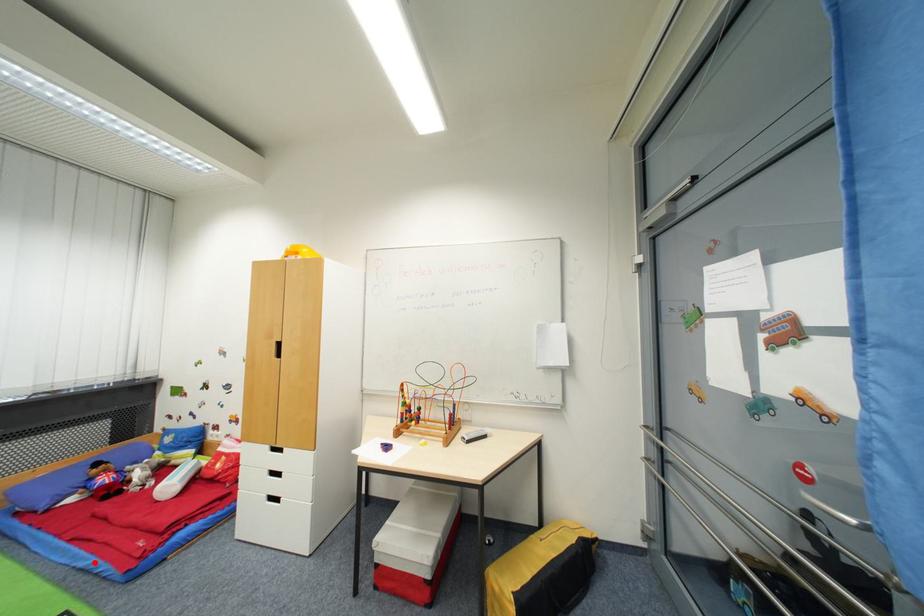
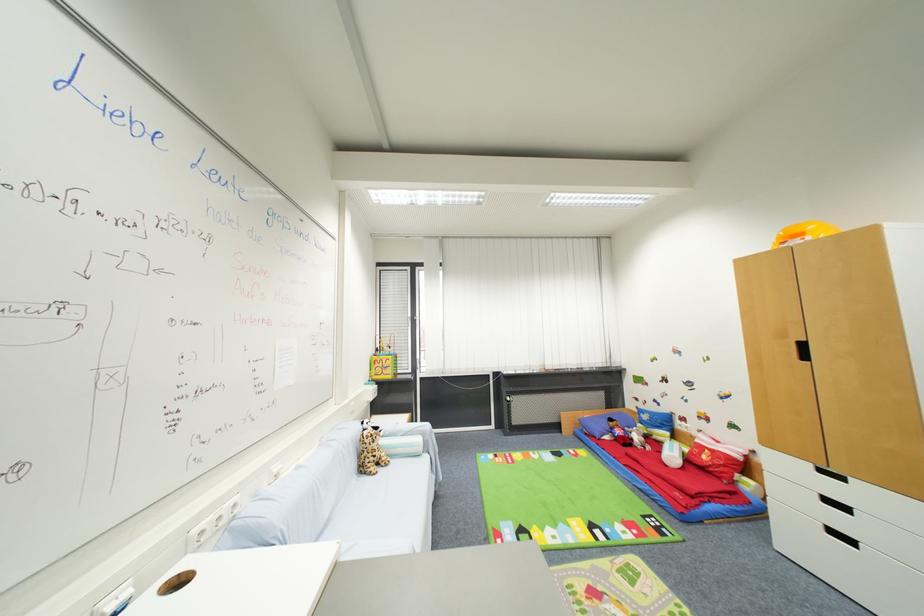
Question: A red point is marked in image1. In image2, is the corresponding 3D point closer to the camera or farther? Reply with the corresponding letter.

Choices:
 (A) The corresponding 3D point is closer.
 (B) The corresponding 3D point is farther.

Answer: (B)